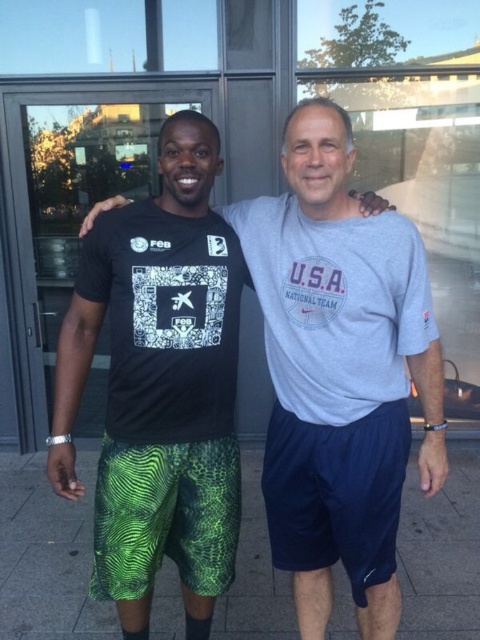
Who is higher up, black matte t-shirt at left or navy blue fabric shorts at center?

Positioned higher is black matte t-shirt at left.

Which is in front, point (355, 372) or point (377, 532)?

Positioned in front is point (355, 372).

Does point (437, 384) lie behind point (302, 472)?

That is False.

Image resolution: width=480 pixels, height=640 pixels. In order to click on black matte t-shirt at left in this screenshot , I will do `click(339, 372)`.

Measure the distance from black matte t-shirt at left to green fabric shorts at lower center.

black matte t-shirt at left is 1.16 meters away from green fabric shorts at lower center.

Is black matte t-shirt at left above green fabric shorts at lower center?

Yes, black matte t-shirt at left is above green fabric shorts at lower center.

Where is `black matte t-shirt at left`? This screenshot has height=640, width=480. black matte t-shirt at left is located at coordinates (339, 372).

Between green fabric shorts at lower center and navy blue fabric shorts at center, which one has less height?

Standing shorter between the two is green fabric shorts at lower center.

The width and height of the screenshot is (480, 640). Identify the location of green fabric shorts at lower center. (47, 556).

What do you see at coordinates (47, 556) in the screenshot? The width and height of the screenshot is (480, 640). I see `green fabric shorts at lower center` at bounding box center [47, 556].

I want to click on green fabric shorts at lower center, so click(47, 556).